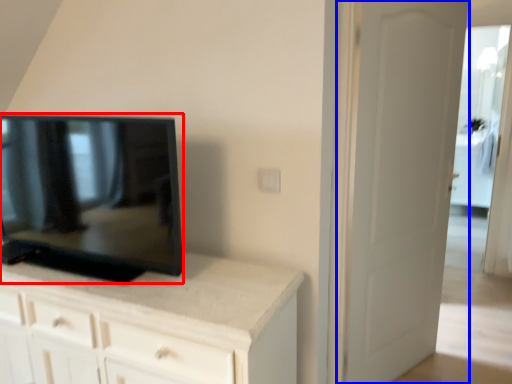
Question: Which point is closer to the camera, television (highlighted by a red box) or door (highlighted by a blue box)?

Choices:
 (A) television
 (B) door

Answer: (A)